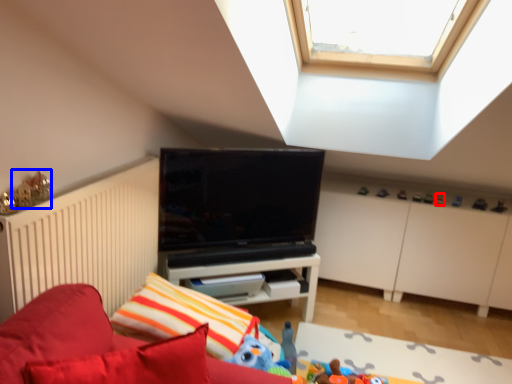
Question: Which object is closer to the camera taking this photo, toy (highlighted by a red box) or toy (highlighted by a blue box)?

Choices:
 (A) toy
 (B) toy

Answer: (B)